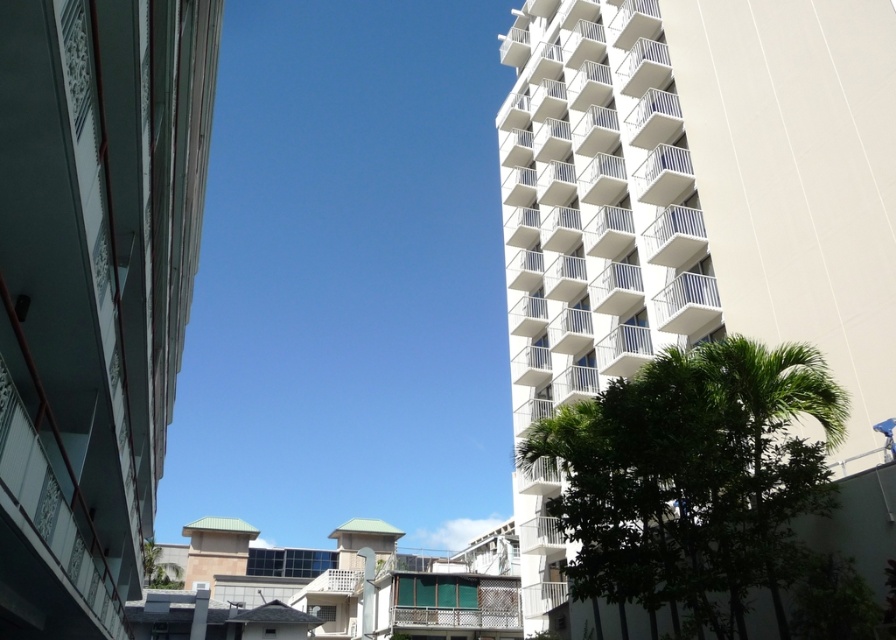
Question: Among these points, which one is nearest to the camera?

Choices:
 (A) (847, 257)
 (B) (101, 525)

Answer: (B)

Question: Does white smooth building at right appear on the left side of white smooth building at upper right?

Choices:
 (A) yes
 (B) no

Answer: (B)

Question: Which object appears farthest from the camera in this image?

Choices:
 (A) white smooth building at right
 (B) white smooth building at upper right

Answer: (A)

Question: Which point is farther to the camera?

Choices:
 (A) white smooth building at upper right
 (B) white smooth building at right

Answer: (B)

Question: Does white smooth building at right have a greater width compared to white smooth building at upper right?

Choices:
 (A) no
 (B) yes

Answer: (A)

Question: From the image, what is the correct spatial relationship of white smooth building at right in relation to white smooth building at upper right?

Choices:
 (A) above
 (B) below

Answer: (A)